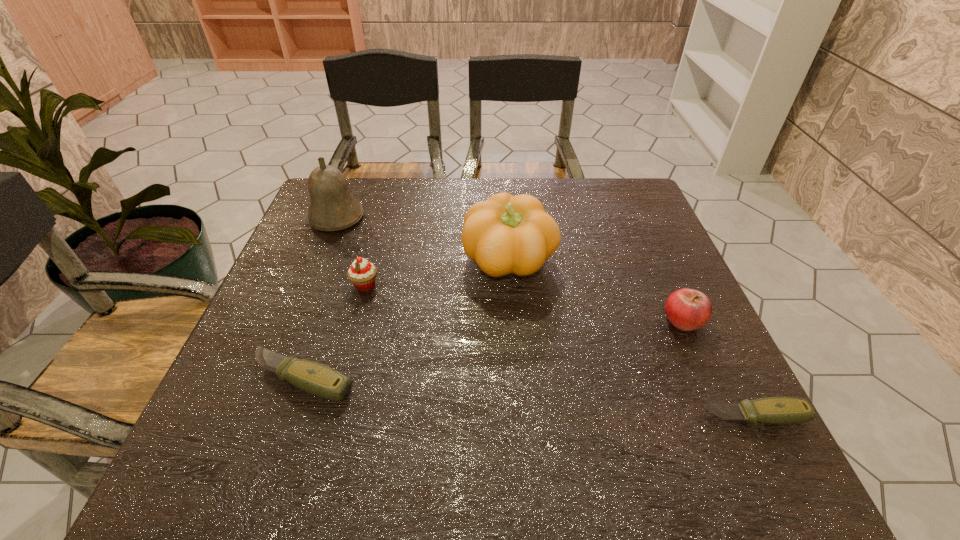
You are a GUI agent. You are given a task and a screenshot of the screen. Output one action in this format:
    pyautogui.click(x=<x>, y=<y>)
    Task: Click on the second shortest object
    Image resolution: width=960 pixels, height=540 pixels.
    Given the screenshot: What is the action you would take?
    pyautogui.click(x=315, y=378)

What are the coordinates of `the taller pocketknife` in the screenshot? It's located at (315, 378).

Locate an element on the screen. the shortest object is located at coordinates (771, 410).

You are a GUI agent. You are given a task and a screenshot of the screen. Output one action in this format:
    pyautogui.click(x=<x>, y=<y>)
    Task: Click on the right pocketknife
    
    Given the screenshot: What is the action you would take?
    771,410

Where is `pumpkin`? This screenshot has height=540, width=960. pumpkin is located at coordinates (505, 234).

You are a GUI agent. You are given a task and a screenshot of the screen. Output one action in this format:
    pyautogui.click(x=<x>, y=<y>)
    Task: Click on the cupcake
    This screenshot has height=540, width=960.
    Given the screenshot: What is the action you would take?
    pyautogui.click(x=362, y=273)

The width and height of the screenshot is (960, 540). What are the coordinates of `bell` in the screenshot? It's located at (332, 207).

You are a GUI agent. You are given a task and a screenshot of the screen. Output one action in this format:
    pyautogui.click(x=<x>, y=<y>)
    Task: Click on the apple
    This screenshot has height=540, width=960.
    Given the screenshot: What is the action you would take?
    pyautogui.click(x=687, y=309)

Identify the location of free spot located 0.050m on the right of the left pocketknife. The height and width of the screenshot is (540, 960). (383, 378).

You are a GUI agent. You are given a task and a screenshot of the screen. Output one action in this format:
    pyautogui.click(x=<x>, y=<y>)
    Task: Click on the vacant space located on the left of the right pocketknife
    
    Given the screenshot: What is the action you would take?
    tap(623, 416)